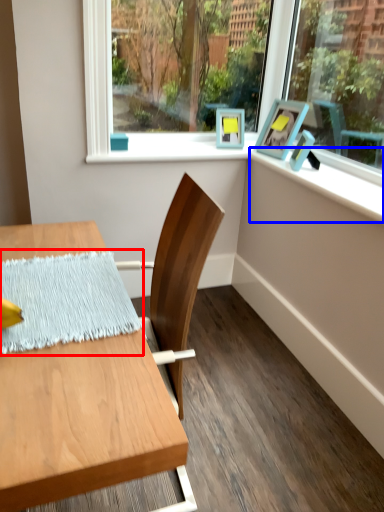
Question: Which object appears farthest to the camera in this image, blanket (highlighted by a red box) or window sill (highlighted by a blue box)?

Choices:
 (A) blanket
 (B) window sill

Answer: (B)